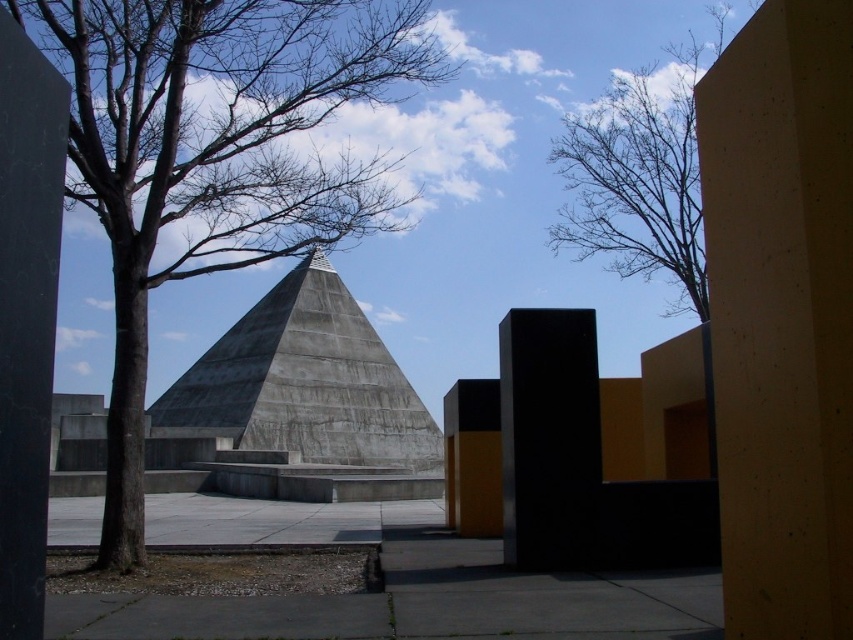
You are standing at the center of the paved area in front of the pyramid structure. There is a black polished pillar at left. Based on its 2D coordinates, can you determine whether the pillar is positioned to your left or right side?

The 2D coordinates of the black polished pillar at left are at point (26, 314). Since the x coordinate is 0.492, which is just under 0.5, the pillar is positioned slightly to the left of the center point. Therefore, from your perspective standing at the center, it would be to your left side.

You are an architect designing a new park layout. You have two pillars to place in the park. The smooth concrete pillar at center right and the black polished pillar at left. Which pillar should you choose if you want to create a focal point with height?

The smooth concrete pillar at center right is much taller than the black polished pillar at left, so it would be the better choice to create a focal point with height.